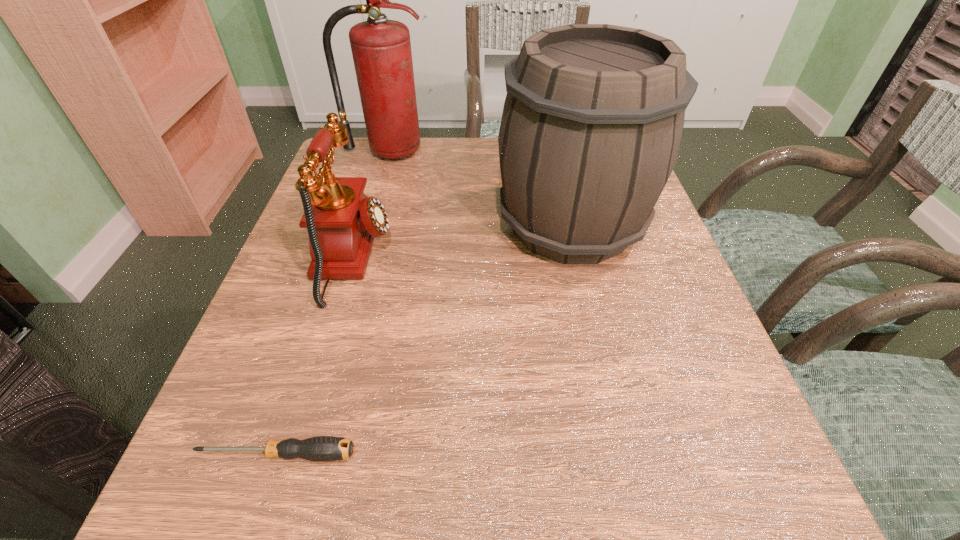
Locate an element on the screen. free space that satisfies the following two spatial constraints: 1. at the front of the wine bucket where the nozzle is aimed; 2. on the left side of the fire extinguisher is located at coordinates (366, 225).